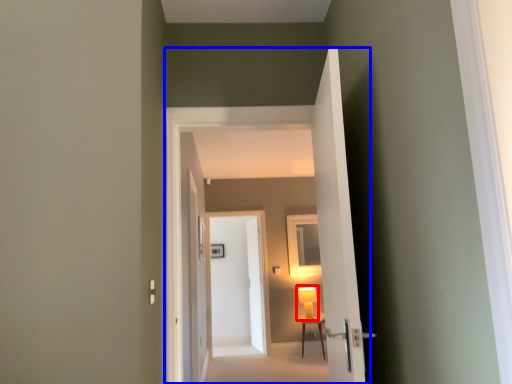
Question: Among these objects, which one is farthest to the camera, table lamp (highlighted by a red box) or corridor (highlighted by a blue box)?

Choices:
 (A) table lamp
 (B) corridor

Answer: (A)